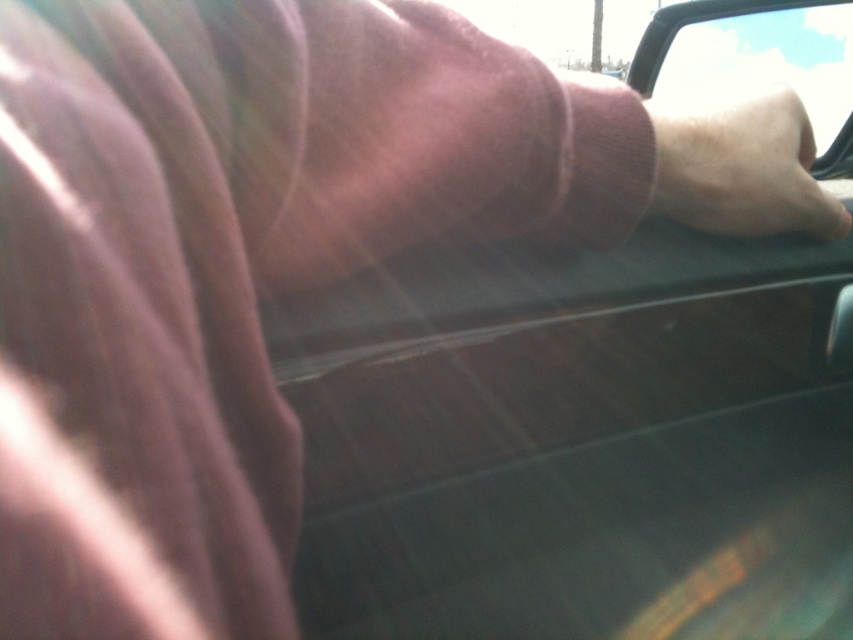
Question: Which object appears closest to the camera in this image?

Choices:
 (A) black plastic car window at upper right
 (B) skinny white hand at upper right

Answer: (B)

Question: Is skinny white hand at upper right wider than black plastic car window at upper right?

Choices:
 (A) no
 (B) yes

Answer: (A)

Question: Is skinny white hand at upper right to the left of black plastic car window at upper right from the viewer's perspective?

Choices:
 (A) yes
 (B) no

Answer: (A)

Question: Where is skinny white hand at upper right located in relation to black plastic car window at upper right in the image?

Choices:
 (A) left
 (B) right

Answer: (A)